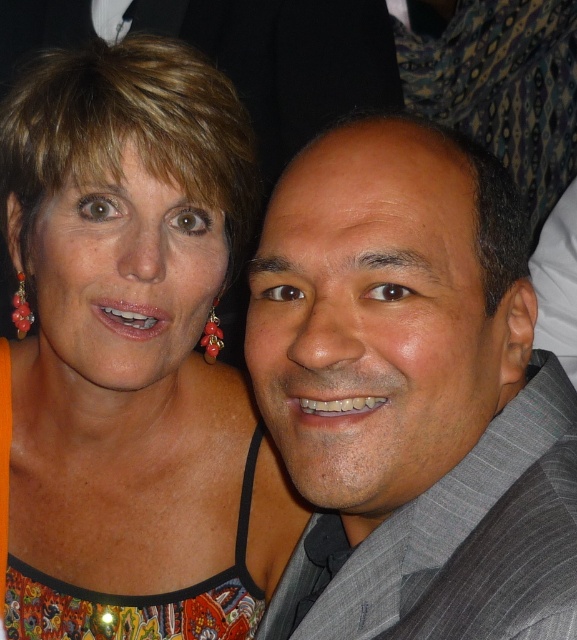
You are a photographer trying to frame a shot where both the multicolored fabric dress at upper left and the gray textured suit at center are visible. Based on their widths, which clothing item might require more space in the frame?

The multicolored fabric dress at upper left might be wider than the gray textured suit at center, so it might require more space in the frame.

You are taking a photo of two people standing in front of you. You notice two points in the image labeled as point (16, 563) and point (404, 145). Which point is closer to your camera?

Point (16, 563) is closer to the camera than point (404, 145).

You are holding a 60 cm wide poster and want to place it so that it covers the point at point (91, 296) without overlapping any part of the two people in the image. Is this possible?

The point (91, 296) is 74.11 centimeters away from the viewer. Since the poster is only 60 cm wide, it can be placed to cover the point without overlapping the people as there is sufficient space between the viewer and the point.